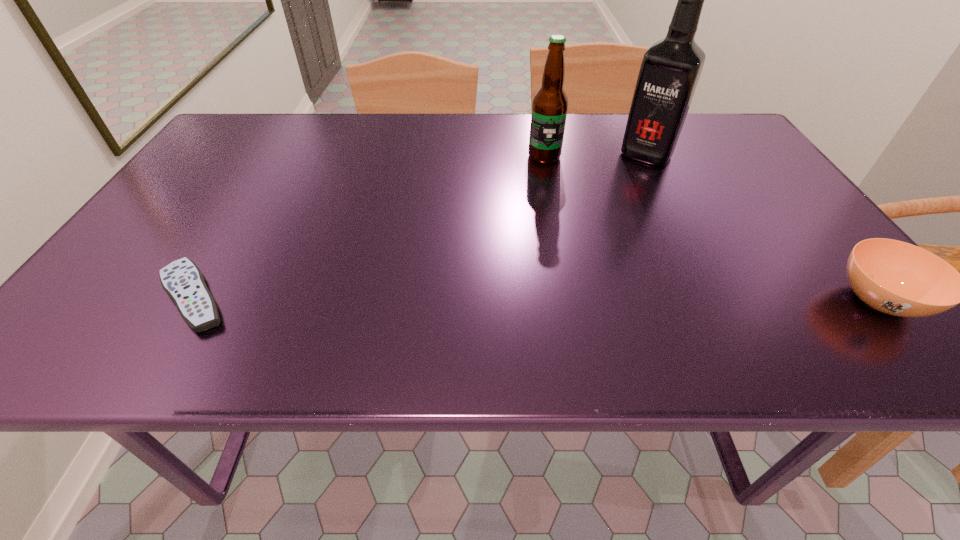
Where is `object that is at the left edge`? This screenshot has height=540, width=960. object that is at the left edge is located at coordinates (182, 280).

Where is `object at the right edge`? object at the right edge is located at coordinates (897, 278).

This screenshot has height=540, width=960. Identify the location of object that is at the near left corner. (182, 280).

Find the location of a particular element. The height and width of the screenshot is (540, 960). object located at the near right corner is located at coordinates (897, 278).

The width and height of the screenshot is (960, 540). I want to click on vacant space at the far edge of the desktop, so click(420, 153).

The image size is (960, 540). In the image, there is a desktop. In order to click on free space at the near edge in this screenshot , I will do `click(487, 303)`.

In the image, there is a desktop. Identify the location of free region at the left edge. (199, 216).

Image resolution: width=960 pixels, height=540 pixels. In the image, there is a desktop. Identify the location of blank space at the far left corner. (276, 117).

In order to click on blank space at the near left corner of the desktop in this screenshot , I will do 154,301.

Where is `vacant region at the far right corner`? vacant region at the far right corner is located at coordinates (717, 121).